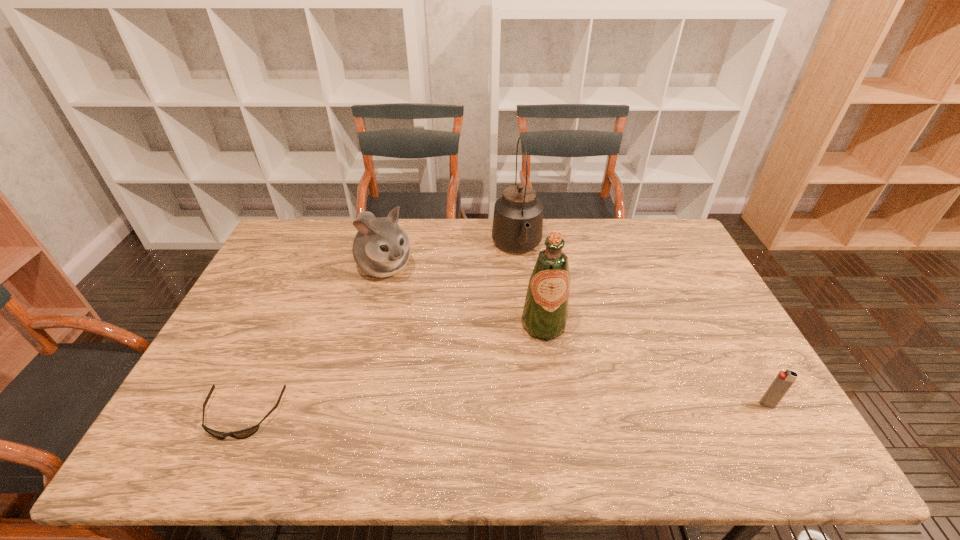
Find the location of a particular element. The width and height of the screenshot is (960, 540). kettle located at the far edge is located at coordinates (517, 226).

At what (x,y) coordinates should I click in order to perform the action: click on sunglasses positioned at the near edge. Please return your answer as a coordinate pair (x, y). Looking at the image, I should click on (245, 433).

Identify the location of igniter positioned at the near edge. The image size is (960, 540). (784, 380).

This screenshot has width=960, height=540. What are the coordinates of `object situated at the left edge` in the screenshot? It's located at (245, 433).

Locate an element on the screen. The image size is (960, 540). object positioned at the right edge is located at coordinates (784, 380).

Find the location of `object present at the near left corner`. object present at the near left corner is located at coordinates (245, 433).

The image size is (960, 540). What are the coordinates of `object located at the near right corner` in the screenshot? It's located at (784, 380).

This screenshot has width=960, height=540. I want to click on free point at the far edge, so (x=438, y=246).

At what (x,y) coordinates should I click in order to perform the action: click on free space at the near edge. Please return your answer as a coordinate pair (x, y). Looking at the image, I should click on (635, 418).

The image size is (960, 540). I want to click on vacant area at the left edge of the desktop, so click(254, 279).